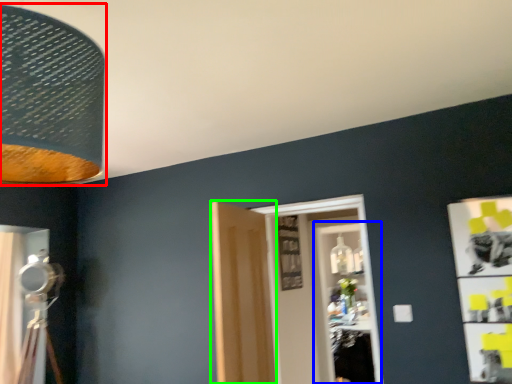
Question: Which is nearer to the lamp (highlighted by a red box)? glass door (highlighted by a blue box) or door (highlighted by a green box).

Choices:
 (A) glass door
 (B) door

Answer: (B)